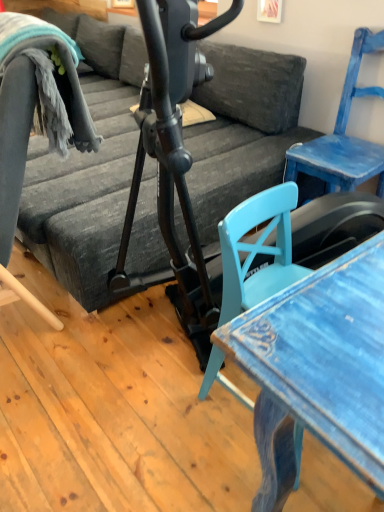
What is the approximate height of distressed blue table at lower right?

It is 30.36 inches.

The width and height of the screenshot is (384, 512). What do you see at coordinates (87, 170) in the screenshot? I see `dark gray fabric couch at center` at bounding box center [87, 170].

In order to click on blue painted wood chair at right in this screenshot , I will do `click(344, 135)`.

Is blue painted wood chair at right far away from distressed blue table at lower right?

Yes, blue painted wood chair at right and distressed blue table at lower right are quite far apart.

Which object is more forward, blue painted wood chair at right or distressed blue table at lower right?

distressed blue table at lower right is more forward.

From a real-world perspective, which is physically below, blue painted wood chair at right or distressed blue table at lower right?

distressed blue table at lower right, from a real-world perspective.

Considering the relative sizes of blue painted wood chair at right and distressed blue table at lower right in the image provided, is blue painted wood chair at right wider than distressed blue table at lower right?

Yes, blue painted wood chair at right is wider than distressed blue table at lower right.

Based on the photo, measure the distance from dark gray fabric couch at center to blue painted wood chair at right.

They are 20.69 inches apart.

Would you say dark gray fabric couch at center is a long distance from blue painted wood chair at right?

Actually, dark gray fabric couch at center and blue painted wood chair at right are a little close together.

Is dark gray fabric couch at center bigger than blue painted wood chair at right?

Correct, dark gray fabric couch at center is larger in size than blue painted wood chair at right.

The width and height of the screenshot is (384, 512). I want to click on chair lying behind the dark gray fabric couch at center, so click(x=344, y=135).

In terms of size, does blue painted wood chair at right appear bigger or smaller than dark gray fabric couch at center?

blue painted wood chair at right is smaller than dark gray fabric couch at center.

Where is `studio couch lying in front of the blue painted wood chair at right`? The height and width of the screenshot is (512, 384). studio couch lying in front of the blue painted wood chair at right is located at coordinates (87, 170).

From the picture: Is blue painted wood chair at right positioned far away from dark gray fabric couch at center?

No, there isn't a large distance between blue painted wood chair at right and dark gray fabric couch at center.

Which object is further away from the camera, distressed blue table at lower right or blue painted wood chair at right?

Positioned behind is blue painted wood chair at right.

What's the angular difference between distressed blue table at lower right and blue painted wood chair at right's facing directions?

The angle between the facing direction of distressed blue table at lower right and the facing direction of blue painted wood chair at right is 92.3 degrees.

Who is taller, distressed blue table at lower right or blue painted wood chair at right?

Standing taller between the two is blue painted wood chair at right.

Is distressed blue table at lower right located outside blue painted wood chair at right?

Yes, distressed blue table at lower right is located beyond the bounds of blue painted wood chair at right.

Is point (258, 97) behind point (351, 428)?

Yes, point (258, 97) is farther from viewer.

Which is correct: dark gray fabric couch at center is inside distressed blue table at lower right, or outside of it?

The correct answer is: outside.

Is dark gray fabric couch at center far from distressed blue table at lower right?

Yes.

Is point (238, 344) closer or farther from the camera than point (77, 251)?

Point (238, 344) is closer to the camera than point (77, 251).

Which object is closer to the camera taking this photo, distressed blue table at lower right or dark gray fabric couch at center?

distressed blue table at lower right is closer to the camera.

Is there a large distance between distressed blue table at lower right and dark gray fabric couch at center?

distressed blue table at lower right is far away from dark gray fabric couch at center.

How different are the orientations of distressed blue table at lower right and dark gray fabric couch at center in degrees?

94.5 degrees separate the facing orientations of distressed blue table at lower right and dark gray fabric couch at center.

This screenshot has height=512, width=384. Identify the location of chair located on the right of distressed blue table at lower right. (344, 135).

Locate an element on the screen. studio couch above the blue painted wood chair at right (from the image's perspective) is located at coordinates coord(87,170).

Estimate the real-world distances between objects in this image. Which object is closer to blue painted wood chair at right, dark gray fabric couch at center or distressed blue table at lower right?

Among the two, dark gray fabric couch at center is located nearer to blue painted wood chair at right.

From the image, which object appears to be farther from blue painted wood chair at right, distressed blue table at lower right or dark gray fabric couch at center?

Based on the image, distressed blue table at lower right appears to be further to blue painted wood chair at right.

From the image, which object appears to be nearer to dark gray fabric couch at center, blue painted wood chair at right or distressed blue table at lower right?

Among the two, blue painted wood chair at right is located nearer to dark gray fabric couch at center.

Considering their positions, is distressed blue table at lower right positioned further to dark gray fabric couch at center than blue painted wood chair at right?

distressed blue table at lower right is positioned further to the anchor dark gray fabric couch at center.

Based on their spatial positions, is blue painted wood chair at right or dark gray fabric couch at center closer to distressed blue table at lower right?

The object closer to distressed blue table at lower right is dark gray fabric couch at center.

Considering their positions, is dark gray fabric couch at center positioned further to distressed blue table at lower right than blue painted wood chair at right?

Among the two, blue painted wood chair at right is located further to distressed blue table at lower right.

This screenshot has width=384, height=512. In order to click on chair between dark gray fabric couch at center and distressed blue table at lower right from top to bottom in this screenshot , I will do `click(344, 135)`.